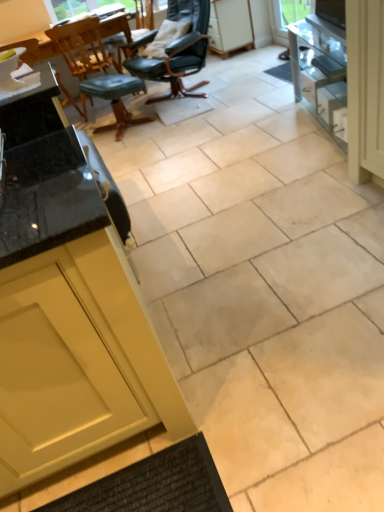
Question: Is leather-like black chair at upper center, the 3th chair positioned from the left, looking in the opposite direction of wooden chair at upper left, the second chair positioned from the left?

Choices:
 (A) no
 (B) yes

Answer: (A)

Question: Considering the relative sizes of leather-like black chair at upper center, the 3th chair positioned from the left, and wooden chair at upper left, the second chair positioned from the left, in the image provided, is leather-like black chair at upper center, the 3th chair positioned from the left, wider than wooden chair at upper left, the second chair positioned from the left,?

Choices:
 (A) yes
 (B) no

Answer: (A)

Question: Is leather-like black chair at upper center, the 3th chair positioned from the left, next to wooden chair at upper left, which is counted as the 2th chair, starting from the right?

Choices:
 (A) no
 (B) yes

Answer: (A)

Question: Can you confirm if leather-like black chair at upper center, the 3th chair positioned from the left, is positioned to the left of wooden chair at upper left, the second chair positioned from the left?

Choices:
 (A) no
 (B) yes

Answer: (A)

Question: From a real-world perspective, is leather-like black chair at upper center, the 3th chair positioned from the left, over wooden chair at upper left, the second chair positioned from the left?

Choices:
 (A) no
 (B) yes

Answer: (B)

Question: Would you say green leather stool at center is inside or outside white matte cabinet at upper center?

Choices:
 (A) outside
 (B) inside

Answer: (A)

Question: From a real-world perspective, is green leather stool at center above or below white matte cabinet at upper center?

Choices:
 (A) above
 (B) below

Answer: (B)

Question: In terms of width, does green leather stool at center look wider or thinner when compared to white matte cabinet at upper center?

Choices:
 (A) thin
 (B) wide

Answer: (B)

Question: Is green leather stool at center taller or shorter than white matte cabinet at upper center?

Choices:
 (A) short
 (B) tall

Answer: (A)

Question: Relative to leather-like black chair at upper center, positioned as the 1th chair in right-to-left order, is matte black chair at left, which is counted as the first chair, starting from the left, in front or behind?

Choices:
 (A) behind
 (B) front

Answer: (A)

Question: Considering the positions of matte black chair at left, the third chair in the right-to-left sequence, and leather-like black chair at upper center, positioned as the 1th chair in right-to-left order, in the image, is matte black chair at left, the third chair in the right-to-left sequence, wider or thinner than leather-like black chair at upper center, positioned as the 1th chair in right-to-left order,?

Choices:
 (A) wide
 (B) thin

Answer: (B)

Question: Is point (13, 45) closer or farther from the camera than point (153, 100)?

Choices:
 (A) closer
 (B) farther

Answer: (A)

Question: From a real-world perspective, is matte black chair at left, the third chair in the right-to-left sequence, above or below leather-like black chair at upper center, positioned as the 1th chair in right-to-left order?

Choices:
 (A) below
 (B) above

Answer: (A)

Question: In the image, is white glossy drawer at right positioned in front of or behind wooden chair at upper left, which is counted as the 2th chair, starting from the right?

Choices:
 (A) behind
 (B) front

Answer: (B)

Question: Considering the positions of white glossy drawer at right and wooden chair at upper left, which is counted as the 2th chair, starting from the right, in the image, is white glossy drawer at right wider or thinner than wooden chair at upper left, which is counted as the 2th chair, starting from the right,?

Choices:
 (A) wide
 (B) thin

Answer: (B)